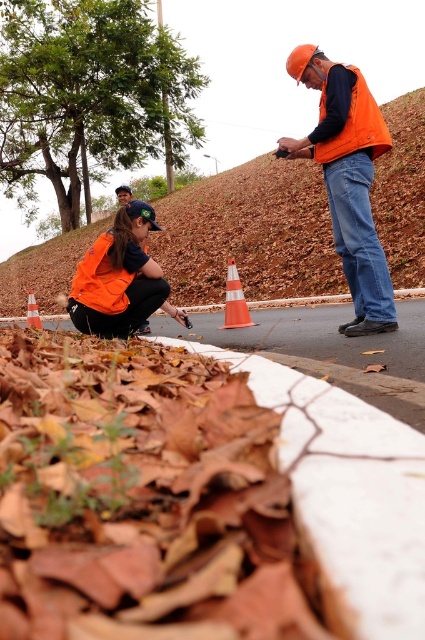
Question: Estimate the real-world distances between objects in this image. Which object is farther from the orange reflective vest at upper right?

Choices:
 (A) orange plastic traffic cone at lower left
 (B) white concrete curb at lower center
 (C) orange fabric cap at lower left
 (D) orange reflective cone at center

Answer: (C)

Question: Which of the following is the farthest from the observer?

Choices:
 (A) orange reflective cone at center
 (B) white concrete curb at lower center
 (C) orange fabric cap at lower left

Answer: (C)

Question: Does brown dirt at upper center appear under white concrete curb at lower center?

Choices:
 (A) no
 (B) yes

Answer: (A)

Question: Among these points, which one is farthest from the camera?

Choices:
 (A) (102, 237)
 (B) (28, 300)

Answer: (B)

Question: Is brown dirt at upper center closer to camera compared to orange reflective cone at center?

Choices:
 (A) yes
 (B) no

Answer: (B)

Question: Can you confirm if brown dirt at upper center is positioned to the right of orange reflective cone at center?

Choices:
 (A) yes
 (B) no

Answer: (B)